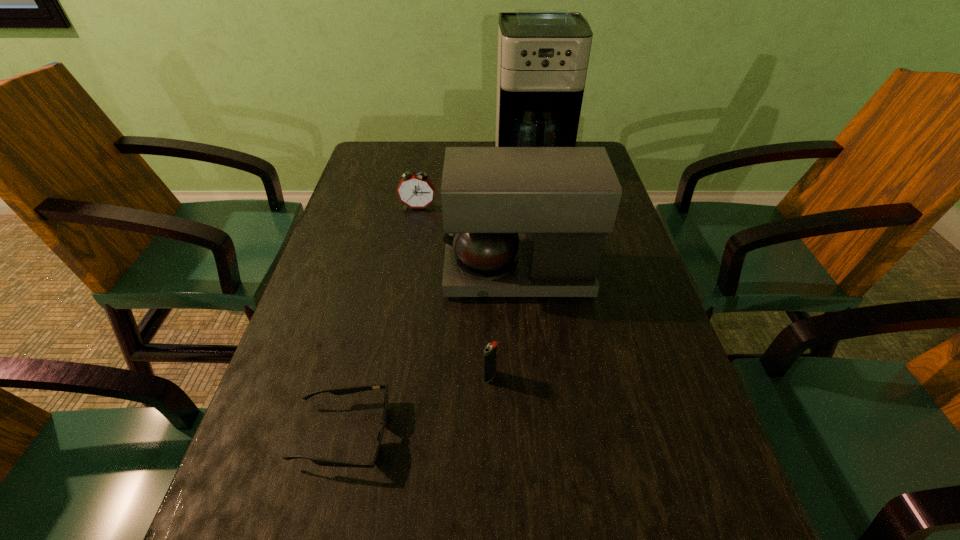
Where is `free spot located 0.170m on the front panel of the tallest object`? free spot located 0.170m on the front panel of the tallest object is located at coordinates click(x=542, y=230).

The image size is (960, 540). In order to click on blank area located on the carafe side of the fourth shortest object in this screenshot , I will do `click(415, 273)`.

This screenshot has height=540, width=960. What are the coordinates of `vacant point located 0.220m on the carafe side of the fourth shortest object` in the screenshot? It's located at (349, 273).

Image resolution: width=960 pixels, height=540 pixels. I want to click on blank space located 0.140m on the carafe side of the fourth shortest object, so click(385, 273).

You are a GUI agent. You are given a task and a screenshot of the screen. Output one action in this format:
    pyautogui.click(x=<x>, y=<y>)
    Task: Click on the vacant space located on the clock face of the alarm clock
    The width and height of the screenshot is (960, 540).
    Given the screenshot: What is the action you would take?
    tap(416, 223)

The image size is (960, 540). I want to click on vacant area situated on the back of the fourth farthest object, so click(x=489, y=321).

Image resolution: width=960 pixels, height=540 pixels. In order to click on vacant area situated on the front-facing side of the nearest object in this screenshot , I will do `click(492, 434)`.

In order to click on object present at the far edge in this screenshot , I will do `click(543, 54)`.

This screenshot has width=960, height=540. Identify the location of alarm clock situated at the left edge. (416, 191).

Identify the location of sunglasses that is positioned at the left edge. (354, 389).